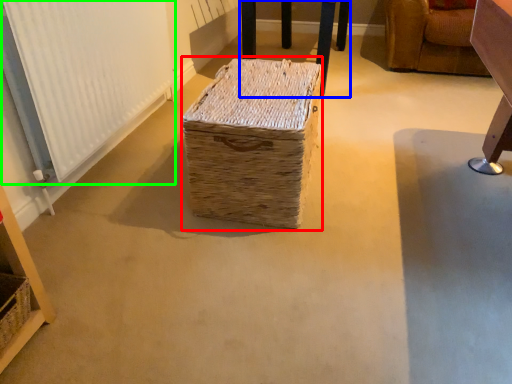
Question: Which is farther away from storage box (highlighted by a red box)? furniture (highlighted by a blue box) or radiator (highlighted by a green box)?

Choices:
 (A) furniture
 (B) radiator

Answer: (A)